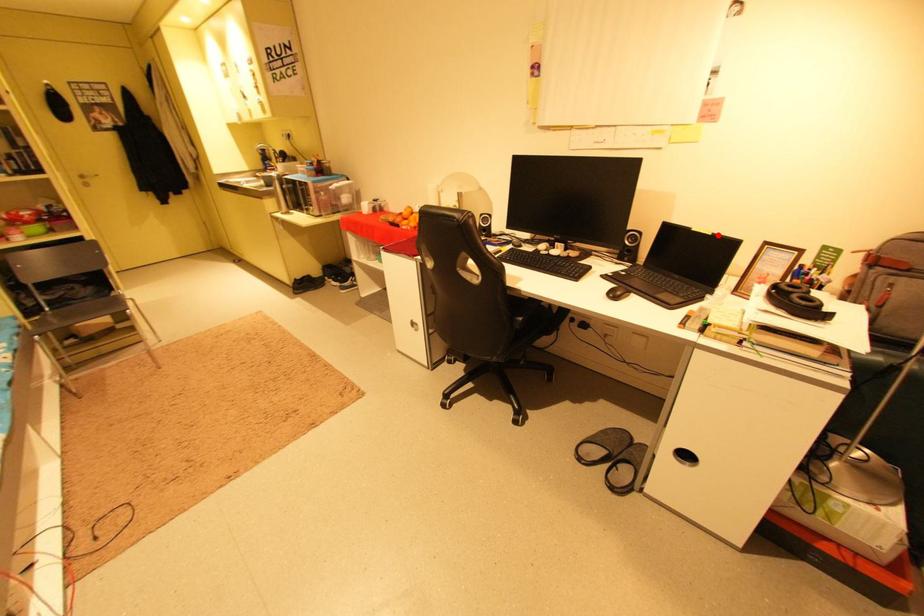
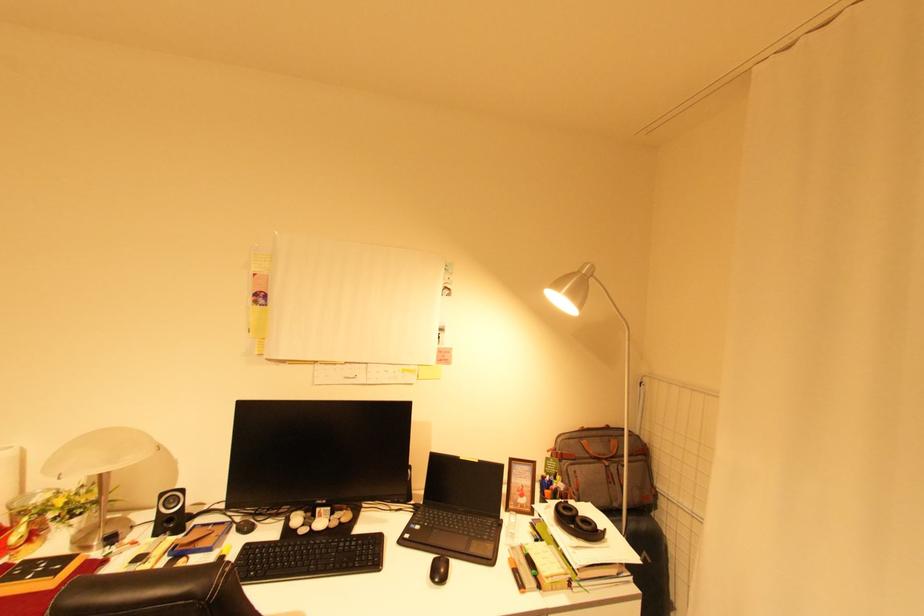
In the second image, find the point that corresponds to the highlighted location in the first image.

(484, 462)